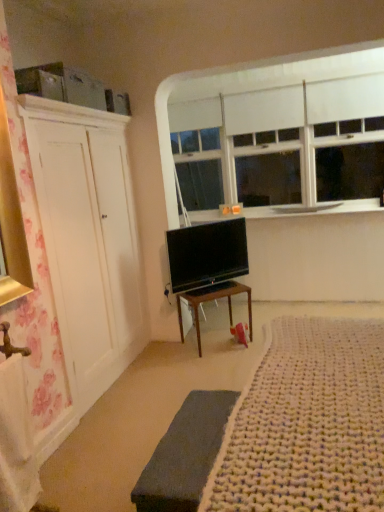
The width and height of the screenshot is (384, 512). In order to click on vacant area that is in front of wooden desk at center in this screenshot , I will do `click(209, 366)`.